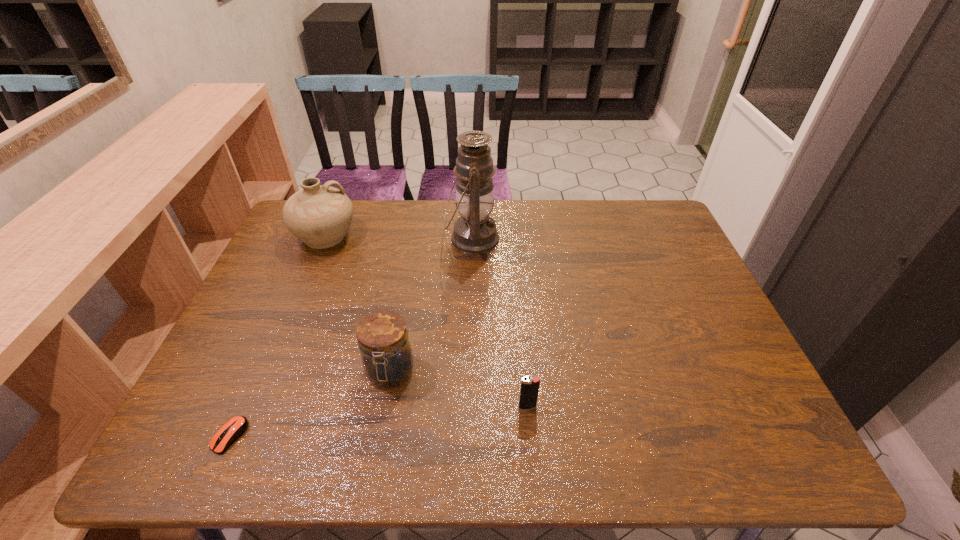
Where is `free space that satisfies the following two spatial constraints: 1. on the back side of the computer mouse; 2. on the right side of the fourth shortest object`? Image resolution: width=960 pixels, height=540 pixels. free space that satisfies the following two spatial constraints: 1. on the back side of the computer mouse; 2. on the right side of the fourth shortest object is located at coordinates (317, 236).